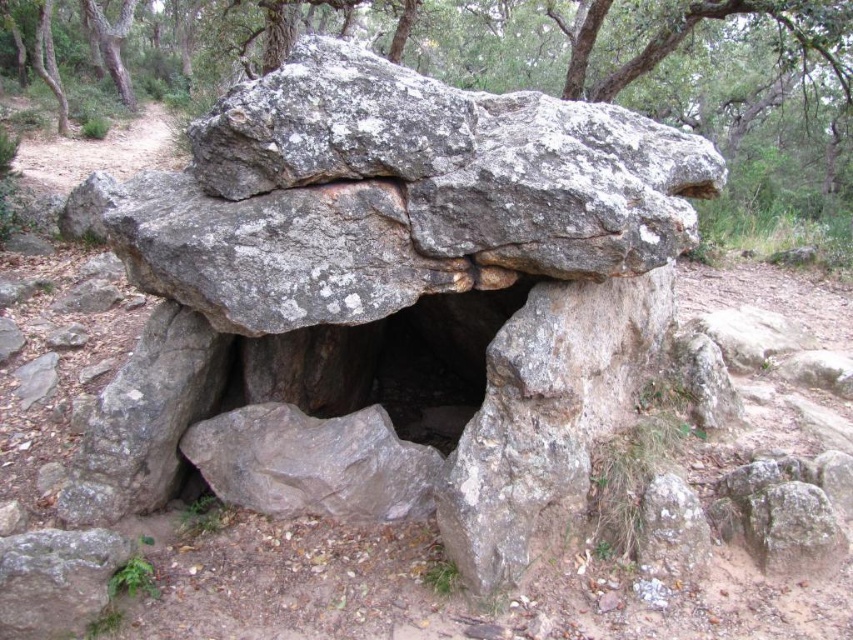
Question: Can you confirm if gray rough stone at center is positioned below gray rough rock at center?

Choices:
 (A) no
 (B) yes

Answer: (B)

Question: Can you confirm if gray rough stone at center is positioned to the left of gray rough rock at center?

Choices:
 (A) no
 (B) yes

Answer: (A)

Question: Which object appears farthest from the camera in this image?

Choices:
 (A) gray rough rock at center
 (B) gray rough stone at center

Answer: (A)

Question: Does gray rough stone at center appear over gray rough rock at center?

Choices:
 (A) yes
 (B) no

Answer: (B)